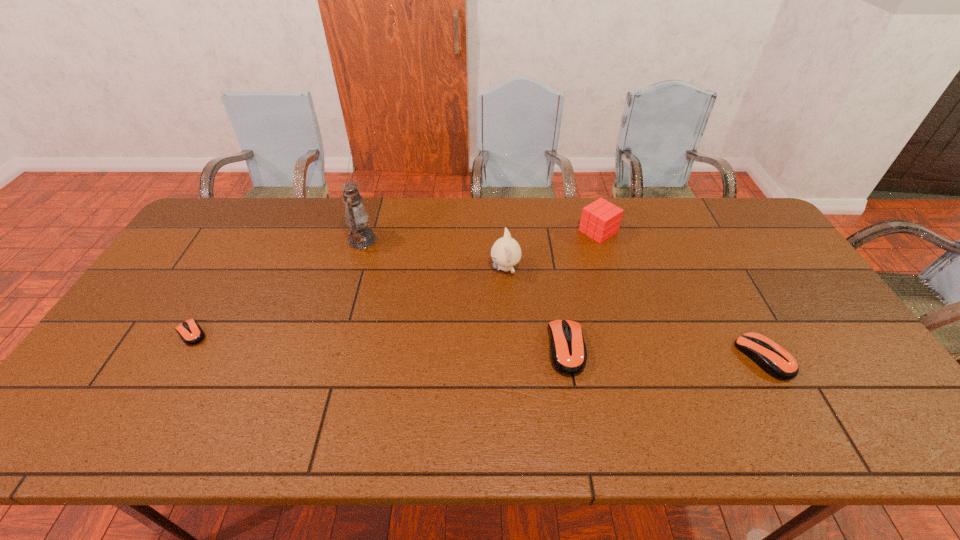
Image resolution: width=960 pixels, height=540 pixels. Find the location of `cube`. cube is located at coordinates (600, 220).

Identify the location of vacant space located 0.140m on the right of the leftmost computer mouse. (261, 333).

The width and height of the screenshot is (960, 540). I want to click on vacant space situated 0.100m on the left of the second computer mouse from right to left, so click(510, 349).

At what (x,y) coordinates should I click in order to perform the action: click on vacant space located 0.320m on the back of the rightmost computer mouse. Please return your answer as a coordinate pair (x, y). Looking at the image, I should click on (708, 254).

Where is `vacant space located 0.180m on the right of the second object from left to right`? vacant space located 0.180m on the right of the second object from left to right is located at coordinates (431, 240).

This screenshot has height=540, width=960. I want to click on free location located on the face of the fourth object from right to left, so click(x=386, y=268).

I want to click on vacant area situated 0.270m on the face of the fourth object from right to left, so click(402, 268).

You are a GUI agent. You are given a task and a screenshot of the screen. Output one action in this format:
    pyautogui.click(x=<x>, y=<y>)
    Task: Click on the free region located on the face of the fourth object from right to left
    
    Given the screenshot: What is the action you would take?
    pyautogui.click(x=444, y=268)

Where is `vacant area situated on the front of the second object from right to left`? The height and width of the screenshot is (540, 960). vacant area situated on the front of the second object from right to left is located at coordinates (625, 321).

This screenshot has height=540, width=960. I want to click on oil lamp at the far edge, so click(360, 237).